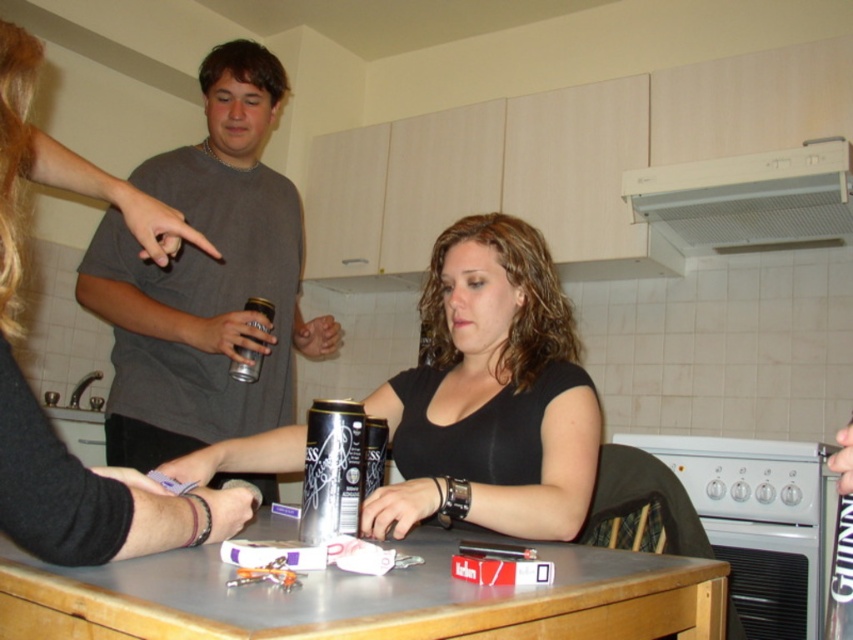
You are organizing a small gathering in the kitchen. You notice a matte black shirt at center and a metallic can at center on the table. Which item is closer to you when you look at the table from the front?

The matte black shirt at center is closer to you because it is in front of the metallic can at center.

You are a bartender preparing drinks and need to place the metallic can at center on the table. However, there is a matte black shirt at center in the way. Can you move the shirt to make space for the can?

The matte black shirt at center is much taller than the metallic can at center, so moving it might be necessary to create enough space for the can.